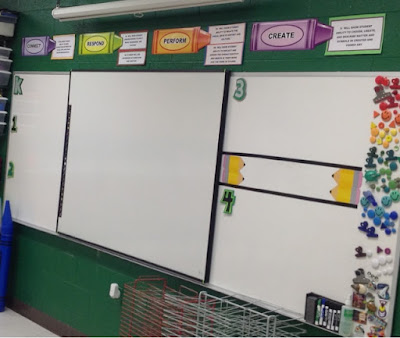
Image resolution: width=400 pixels, height=338 pixels. In order to click on green wall in this screenshot , I will do `click(63, 295)`, `click(187, 62)`.